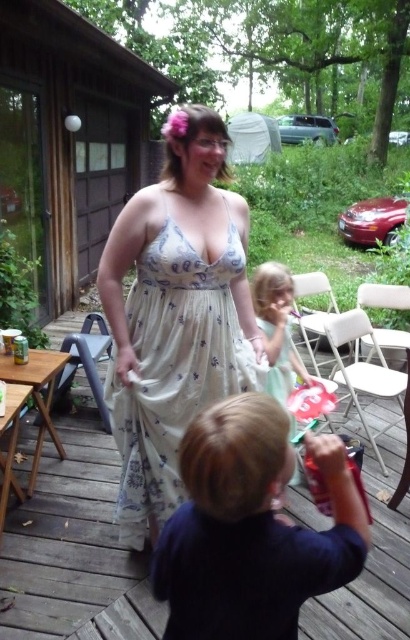
Who is shorter, wooden deck at center or white floral dress at center?

wooden deck at center

Is the position of wooden deck at center less distant than that of white floral dress at center?

No, it is behind white floral dress at center.

Is point (398, 616) positioned before point (136, 257)?

No.

This screenshot has width=410, height=640. Find the location of `wooden deck at center`. wooden deck at center is located at coordinates (73, 547).

Between wooden deck at center and light green fabric dress at center, which one has less height?

Standing shorter between the two is light green fabric dress at center.

Is point (77, 518) less distant than point (252, 296)?

Yes, point (77, 518) is closer to viewer.

The height and width of the screenshot is (640, 410). I want to click on wooden deck at center, so [x=73, y=547].

Which of these two, wooden deck at center or dark blue shirt at lower center, stands taller?

wooden deck at center

What do you see at coordinates (73, 547) in the screenshot?
I see `wooden deck at center` at bounding box center [73, 547].

Identify the location of wooden deck at center. (73, 547).